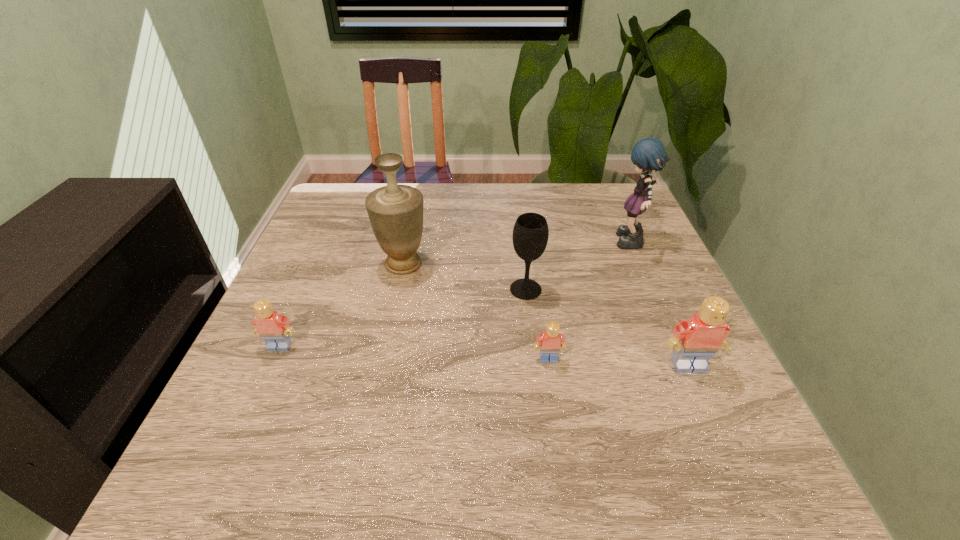
The image size is (960, 540). In order to click on the fifth tallest object in this screenshot , I will do `click(274, 329)`.

Where is `the leftmost object`? This screenshot has width=960, height=540. the leftmost object is located at coordinates (274, 329).

You are a GUI agent. You are given a task and a screenshot of the screen. Output one action in this format:
    pyautogui.click(x=<x>, y=<y>)
    Task: Click on the shortest Lego
    This screenshot has width=960, height=540.
    Given the screenshot: What is the action you would take?
    [x=551, y=341]

The width and height of the screenshot is (960, 540). I want to click on the shortest object, so click(551, 341).

I want to click on the rightmost Lego, so click(x=696, y=340).

The width and height of the screenshot is (960, 540). I want to click on rag doll, so click(x=648, y=154).

Locate an element on the screen. Image resolution: width=960 pixels, height=540 pixels. wineglass is located at coordinates (530, 235).

Where is `urn`? urn is located at coordinates (395, 211).

You are a GUI agent. You are given a task and a screenshot of the screen. Output one action in this format:
    pyautogui.click(x=<x>, y=<y>)
    Task: Click on the vacant space located on the front-facing side of the farthest Lego
    This screenshot has width=960, height=540.
    Given the screenshot: What is the action you would take?
    pyautogui.click(x=247, y=420)

The height and width of the screenshot is (540, 960). In order to click on free location located 0.110m on the front-facing side of the shortest object in this screenshot , I will do `click(557, 414)`.